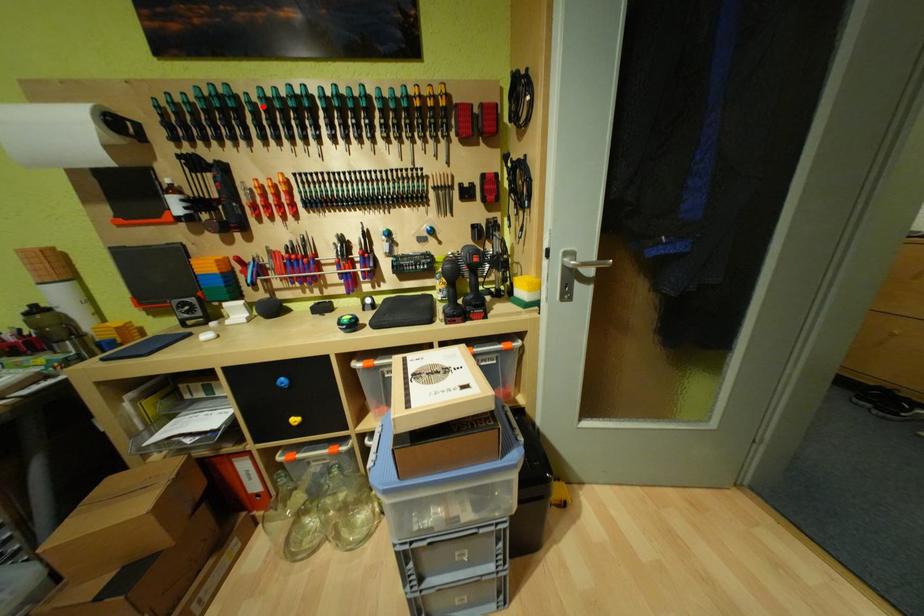
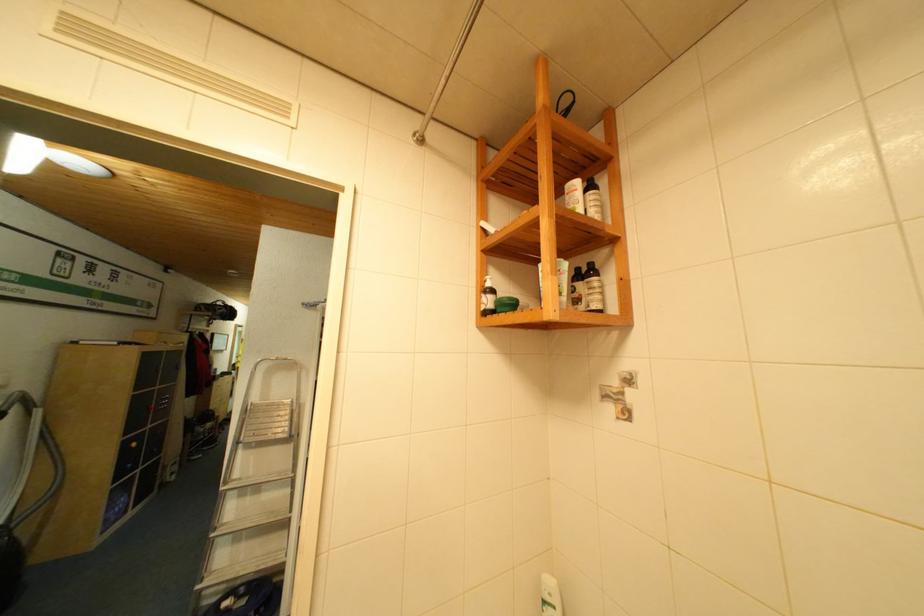
Question: I am providing you with two images of the same scene from different viewpoints. A red point is marked on the first image. At the location where the point appears in image 1, is it still visible in image 2?

Choices:
 (A) Yes
 (B) No

Answer: (B)